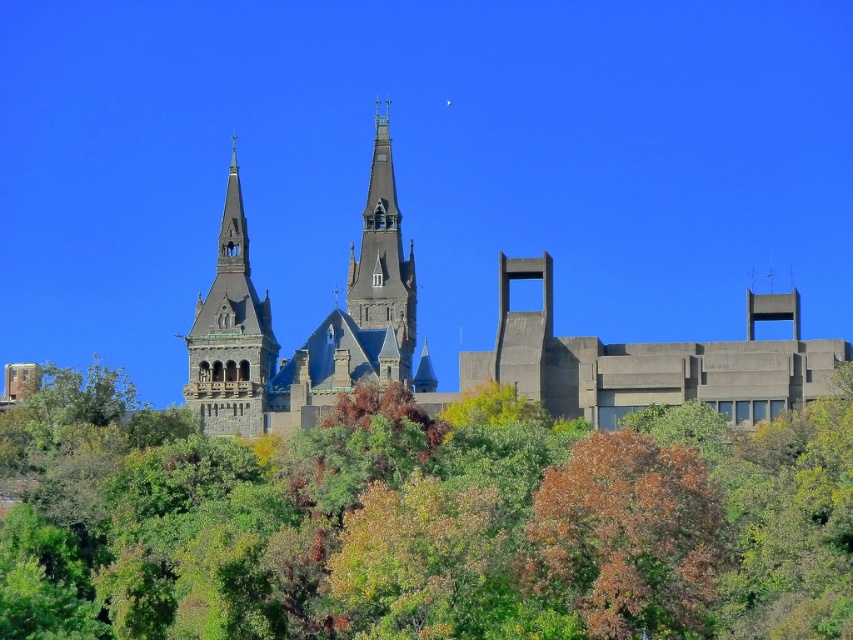
Can you confirm if brown leafy tree at lower center is wider than stone gothic tower at upper left?

Yes, brown leafy tree at lower center is wider than stone gothic tower at upper left.

Can you confirm if brown leafy tree at lower center is positioned to the right of stone gothic tower at upper left?

Yes, brown leafy tree at lower center is to the right of stone gothic tower at upper left.

Does point (637, 486) come in front of point (229, 227)?

Yes, point (637, 486) is closer to viewer.

The width and height of the screenshot is (853, 640). I want to click on brown leafy tree at lower center, so click(x=627, y=536).

Consider the image. Who is positioned more to the left, stone gothic tower at upper left or smooth gray stone tower at center?

stone gothic tower at upper left

Does stone gothic tower at upper left appear on the left side of smooth gray stone tower at center?

Indeed, stone gothic tower at upper left is positioned on the left side of smooth gray stone tower at center.

Does point (230, 374) lie behind point (402, 356)?

No, it is not.

I want to click on stone gothic tower at upper left, so click(x=230, y=333).

Does point (195, 481) lie behind point (219, 372)?

No.

Can you confirm if green leafy tree at center is positioned below stone gothic tower at upper left?

Yes, green leafy tree at center is below stone gothic tower at upper left.

Is point (102, 426) less distant than point (247, 378)?

No.

Find the location of a particular element. green leafy tree at center is located at coordinates (426, 524).